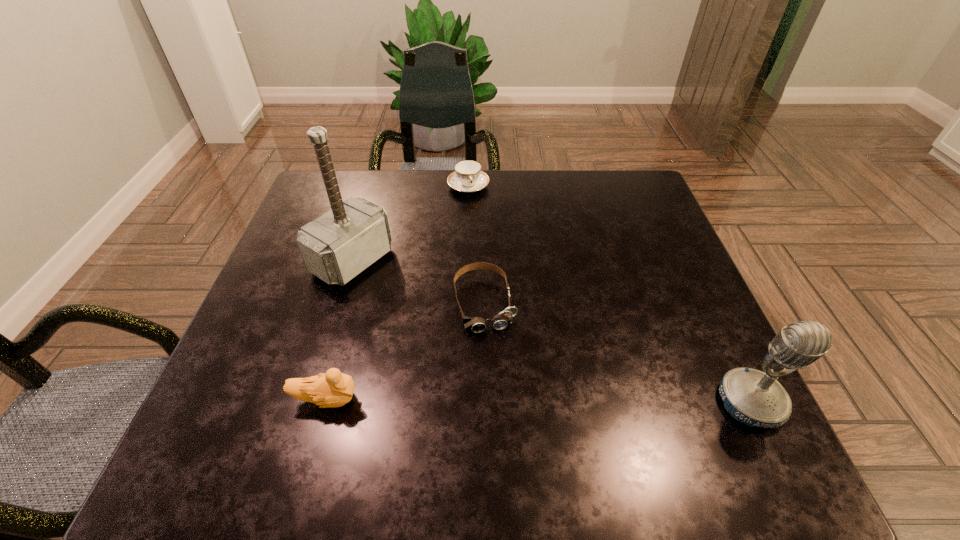
The image size is (960, 540). Identify the location of hammer situated at the left edge. (337, 246).

Where is `object that is at the right edge`? object that is at the right edge is located at coordinates (754, 398).

At what (x,y) coordinates should I click in order to perform the action: click on object at the near left corner. Please return your answer as a coordinate pair (x, y). This screenshot has width=960, height=540. Looking at the image, I should click on (331, 389).

Identify the location of object at the near right corner. This screenshot has height=540, width=960. (754, 398).

Image resolution: width=960 pixels, height=540 pixels. In the image, there is a desktop. Identify the location of vacant region at the far edge. (426, 197).

In the image, there is a desktop. Identify the location of vacant area at the left edge. Image resolution: width=960 pixels, height=540 pixels. (324, 329).

Identify the location of blank space at the right edge of the desktop. (722, 340).

What are the coordinates of `free space at the near left corner of the desktop` in the screenshot? It's located at (244, 392).

The height and width of the screenshot is (540, 960). I want to click on free space at the far right corner of the desktop, so click(621, 172).

You are a GUI agent. You are given a task and a screenshot of the screen. Output one action in this format:
    pyautogui.click(x=<x>, y=<y>)
    Task: Click on the vacant region between the hammer and the third shortest object
    The height and width of the screenshot is (540, 960).
    Given the screenshot: What is the action you would take?
    pyautogui.click(x=339, y=330)